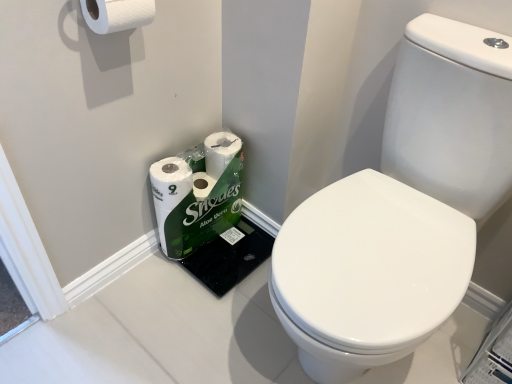
You are a GUI agent. You are given a task and a screenshot of the screen. Output one action in this format:
    pyautogui.click(x=<x>, y=<y>)
    Task: Click on the free location in front of white glossy toilet paper at lower left, acting as the first toilet paper starting from the bottom
    
    Given the screenshot: What is the action you would take?
    pyautogui.click(x=220, y=275)